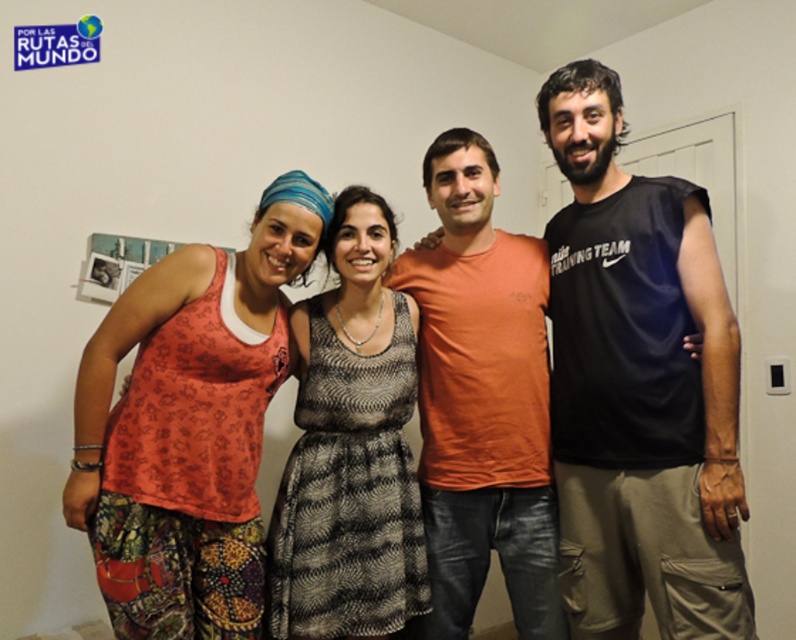
Based on the photo, based on the scene description, where is the printed cotton tank top at left located in the image?

The printed cotton tank top at left is located at point coordinates of 0.666 on the x axis and 0.239 on the y axis.

You are trying to find the person wearing the black sleeveless shirt at right and the matte black tank top at center in the group photo. Which one is located to the right of the other?

The black sleeveless shirt at right is positioned on the right side of the matte black tank top at center.

You are organizing a clothing donation drive and need to determine which clothing items are suitable for adults. You see the printed cotton tank top at left and the patterned fabric dress at center in the image. Based on their sizes, which one is more likely to fit an adult?

The printed cotton tank top at left has a larger size compared to the patterned fabric dress at center, so it is more likely to fit an adult.